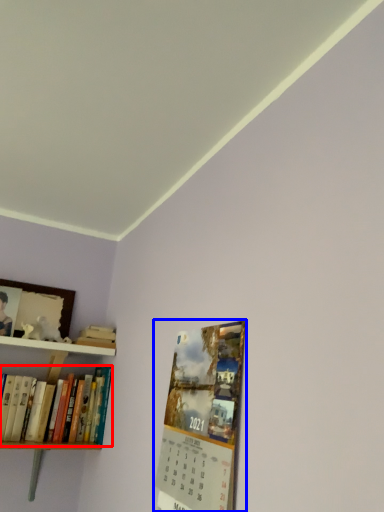
Question: Which object is closer to the camera taking this photo, book (highlighted by a red box) or magazine (highlighted by a blue box)?

Choices:
 (A) book
 (B) magazine

Answer: (B)